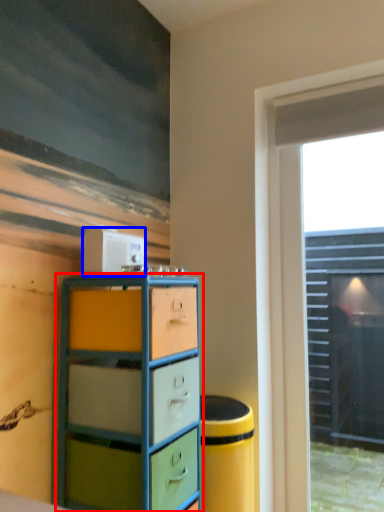
Question: Which point is further to the camera, chest of drawers (highlighted by a red box) or appliance (highlighted by a blue box)?

Choices:
 (A) chest of drawers
 (B) appliance

Answer: (B)